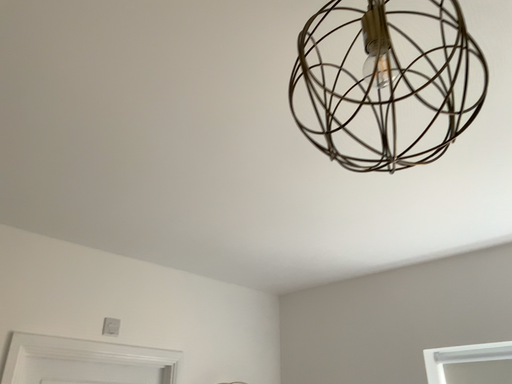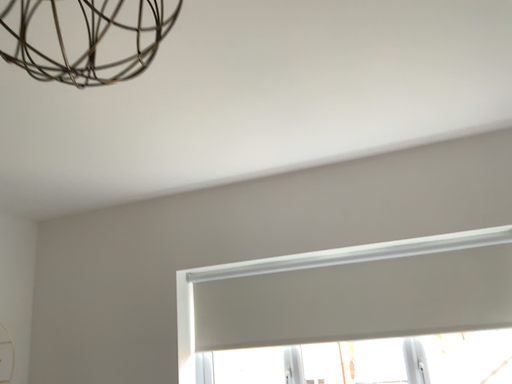
Question: How did the camera likely rotate when shooting the video?

Choices:
 (A) rotated downward
 (B) rotated upward

Answer: (A)